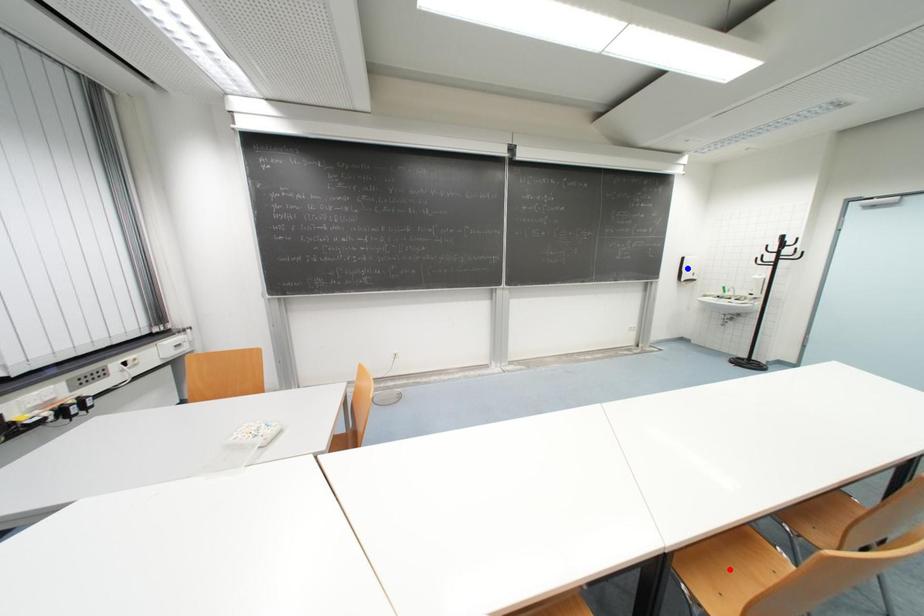
Question: Two points are marked on the image. Which point is closer to the camera?

Choices:
 (A) Blue point is closer.
 (B) Red point is closer.

Answer: (B)